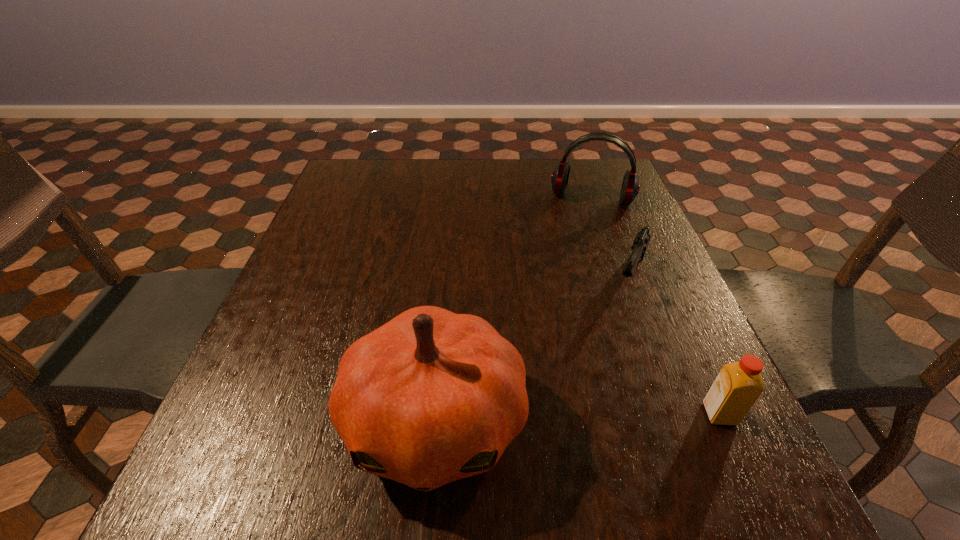
I want to click on vacant space on the desktop that is between the pumpkin and the orange juice and is positioned at the end of the barrel of the gun, so pyautogui.click(x=570, y=417).

Locate an element on the screen. The width and height of the screenshot is (960, 540). free space on the desktop that is between the pumpkin and the orange juice and is positioned on the ear cups of the third shortest object is located at coordinates (540, 418).